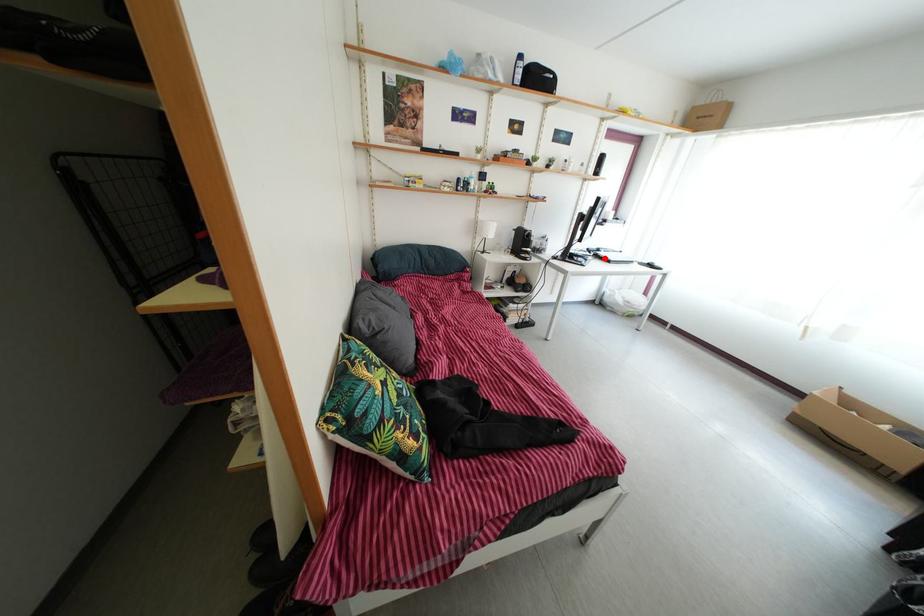
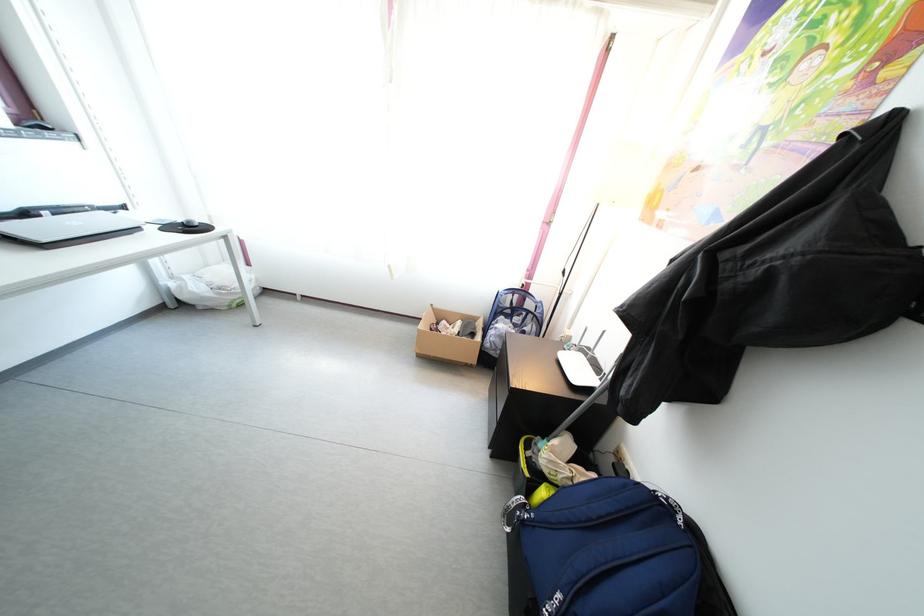
The point at the highlighted location is marked in the first image. Where is the corresponding point in the second image?

(31, 222)